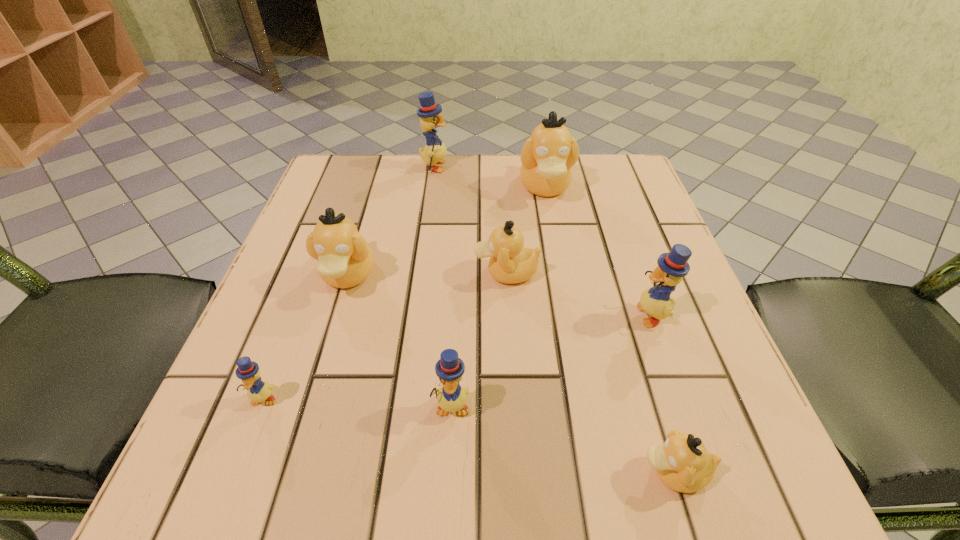
You are a GUI agent. You are given a task and a screenshot of the screen. Output one action in this format:
    pyautogui.click(x=<x>, y=<y>)
    Task: Click on the sixth duckling from right to left
    The width and height of the screenshot is (960, 540).
    Given the screenshot: What is the action you would take?
    pyautogui.click(x=434, y=152)

Locate an element on the screen. the biggest yellow duckling is located at coordinates (434, 152).

This screenshot has height=540, width=960. Identify the location of the biggest tan duckling. (547, 156).

At what (x,y) coordinates should I click in order to perform the action: click on the third smallest yellow duckling. Please return your answer as a coordinate pair (x, y). The height and width of the screenshot is (540, 960). Looking at the image, I should click on (673, 266).

You are a GUI agent. You are given a task and a screenshot of the screen. Output one action in this format:
    pyautogui.click(x=<x>, y=<y>)
    Task: Click on the third nearest yellow duckling
    Image resolution: width=960 pixels, height=540 pixels.
    Given the screenshot: What is the action you would take?
    pyautogui.click(x=673, y=266)

In order to click on the second biggest tan duckling in this screenshot , I will do `click(345, 259)`.

Locate an element on the screen. This screenshot has height=540, width=960. the second smallest tan duckling is located at coordinates (510, 263).

Locate an element on the screen. The width and height of the screenshot is (960, 540). the second yellow duckling from right to left is located at coordinates (452, 397).

Where is `the fourth object from left to right`? This screenshot has width=960, height=540. the fourth object from left to right is located at coordinates (452, 397).

At what (x,y) coordinates should I click in order to perform the action: click on the nearest duckling. Please return your answer as a coordinate pair (x, y). Looking at the image, I should click on (682, 463).